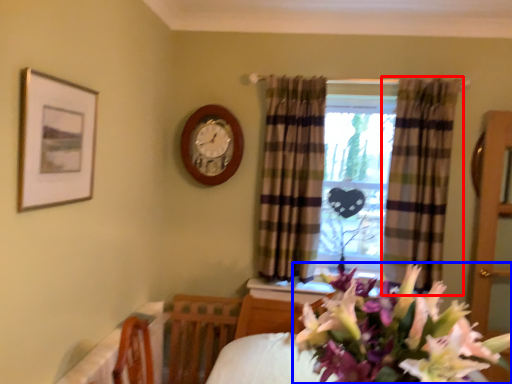
Question: Which object is further to the camera taking this photo, curtain (highlighted by a red box) or flower (highlighted by a blue box)?

Choices:
 (A) curtain
 (B) flower

Answer: (A)